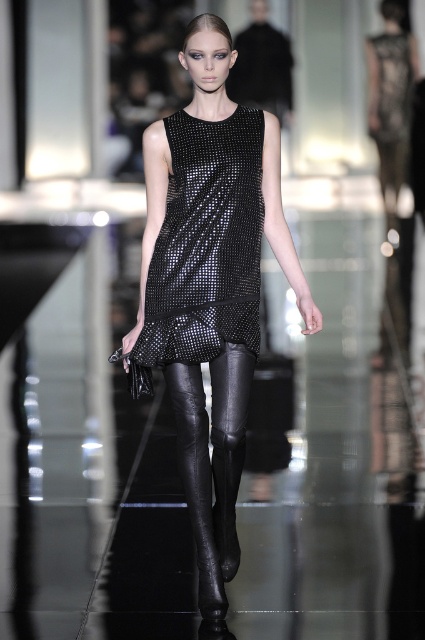
You are standing in the runway audience and want to take a photo of the point at coordinates point (223, 264). If your camera can focus on objects within 4 meters, will you be able to capture the point clearly?

The distance of point (223, 264) from the viewer is 4.16 meters, which is slightly beyond the camera focus range of 4 meters. Therefore, the point cannot be captured clearly.

You are a photographer at the runway show and want to capture the model wearing the shiny black dress at center and black leather tights at center. Which piece of clothing is visible on top of the other?

The shiny black dress at center is positioned over the black leather tights at center, so the dress is visible on top of the tights.